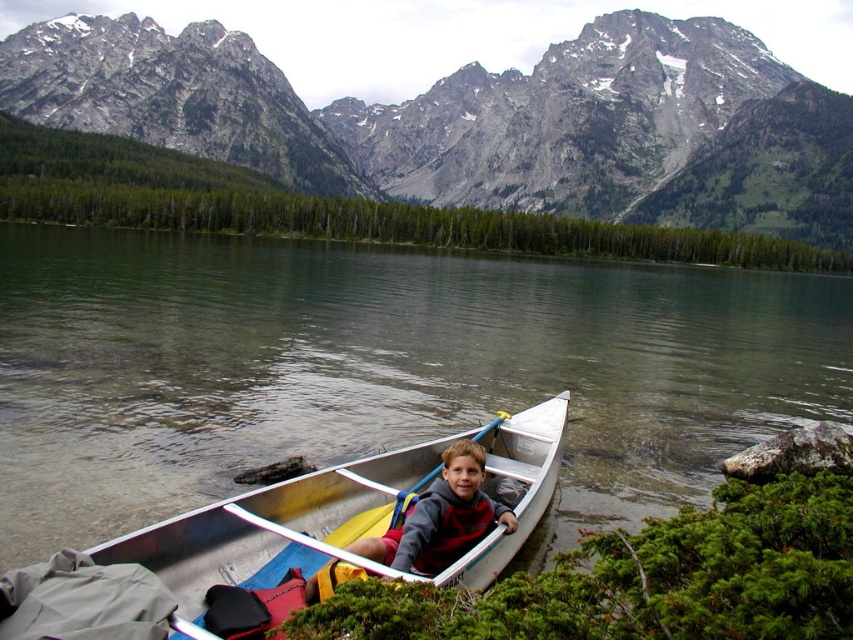
Question: Which object is the closest to the silver metallic canoe at center?

Choices:
 (A) yellow plastic paddle at center
 (B) gray rocky mountain at upper center

Answer: (A)

Question: Which of the following is the farthest from the observer?

Choices:
 (A) silver metallic canoe at center
 (B) yellow plastic paddle at center

Answer: (B)

Question: Does silver metallic canoe at center have a greater width compared to yellow plastic paddle at center?

Choices:
 (A) no
 (B) yes

Answer: (B)

Question: Is gray rocky mountain at upper center above yellow plastic paddle at center?

Choices:
 (A) yes
 (B) no

Answer: (A)

Question: Which point is closer to the camera?

Choices:
 (A) gray rocky mountain at upper center
 (B) silver metallic canoe at center
 (C) yellow plastic paddle at center

Answer: (B)

Question: Can you confirm if silver metallic canoe at center is positioned above yellow plastic paddle at center?

Choices:
 (A) yes
 (B) no

Answer: (B)